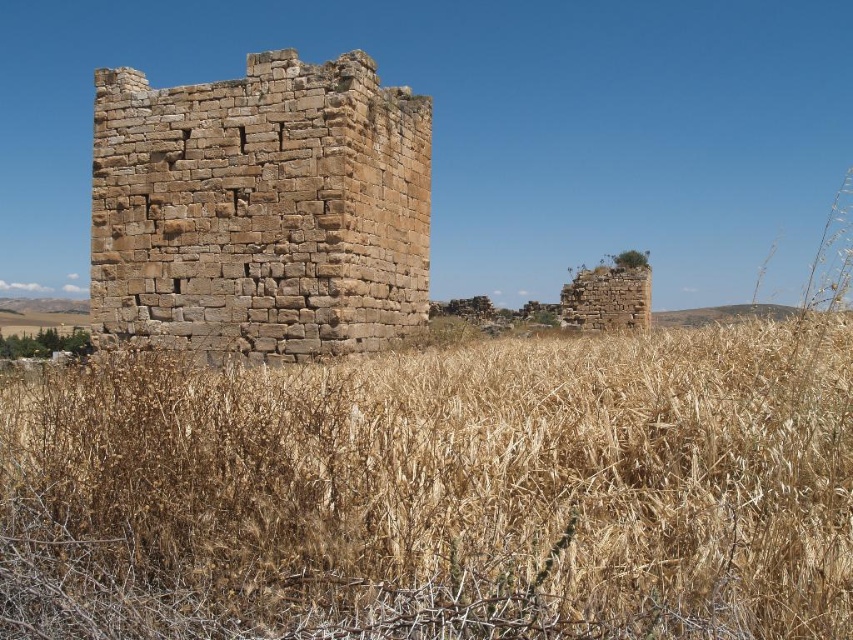
Question: From the image, what is the correct spatial relationship of brown dry grass at center in relation to brown stone ruins at center?

Choices:
 (A) below
 (B) above

Answer: (A)

Question: Which point appears closest to the camera in this image?

Choices:
 (A) (369, 312)
 (B) (527, 406)

Answer: (B)

Question: Does brown dry grass at center have a lesser width compared to brown stone ruins at center?

Choices:
 (A) no
 (B) yes

Answer: (A)

Question: Does brown dry grass at center have a smaller size compared to brown stone ruins at center?

Choices:
 (A) yes
 (B) no

Answer: (B)